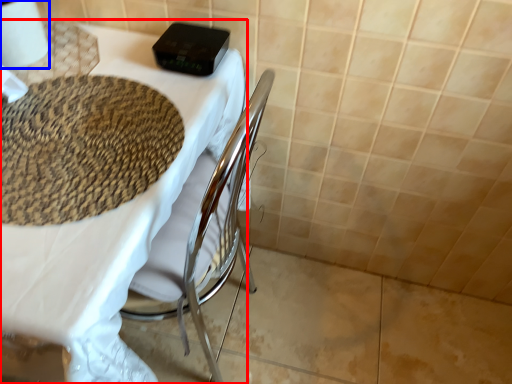
Question: Which object appears farthest to the camera in this image, table (highlighted by a red box) or toilet paper (highlighted by a blue box)?

Choices:
 (A) table
 (B) toilet paper

Answer: (B)